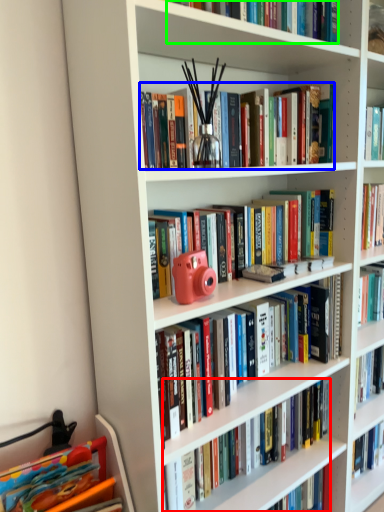
Question: Which object is positioned closest to book (highlighted by a red box)? Select from book (highlighted by a blue box) and book (highlighted by a green box).

Choices:
 (A) book
 (B) book

Answer: (A)